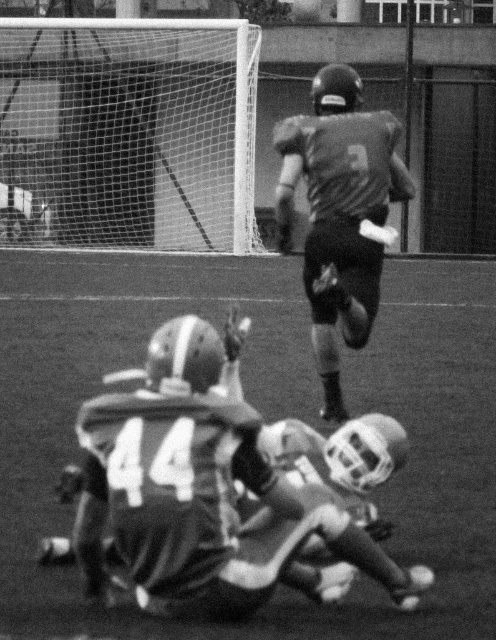
Does smooth turf football field at center have a lesser height compared to gray matte jersey at upper center?

Yes, smooth turf football field at center is shorter than gray matte jersey at upper center.

Between smooth turf football field at center and gray matte jersey at upper center, which one is positioned lower?

smooth turf football field at center is lower down.

Is point (309, 365) positioned after point (321, 173)?

Yes, it is behind point (321, 173).

Where is `smooth turf football field at center`? This screenshot has width=496, height=640. smooth turf football field at center is located at coordinates (264, 417).